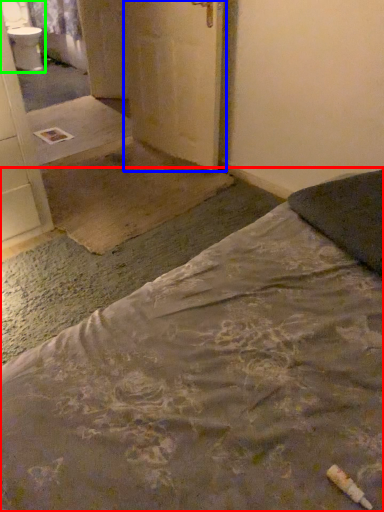
Question: Based on their relative distances, which object is farther from bed (highlighted by a red box)? Choose from door (highlighted by a blue box) and sink (highlighted by a green box).

Choices:
 (A) door
 (B) sink

Answer: (B)